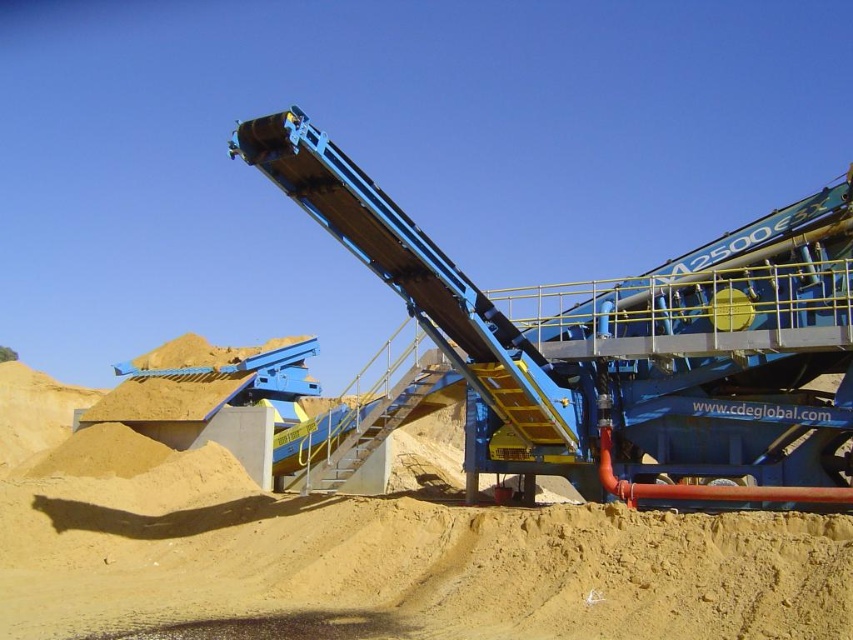
Question: Among these points, which one is farthest from the camera?

Choices:
 (A) (770, 477)
 (B) (798, 566)

Answer: (A)

Question: Does yellow sand at center have a smaller size compared to blue metallic conveyor at center?

Choices:
 (A) no
 (B) yes

Answer: (A)

Question: Can you confirm if yellow sand at center is positioned above blue metallic conveyor at center?

Choices:
 (A) no
 (B) yes

Answer: (A)

Question: Is yellow sand at center thinner than blue metallic conveyor at center?

Choices:
 (A) no
 (B) yes

Answer: (A)

Question: Which point is farther to the camera?

Choices:
 (A) yellow sand at center
 (B) blue metallic conveyor at center

Answer: (B)